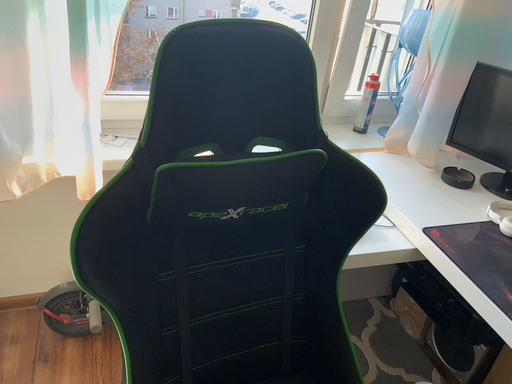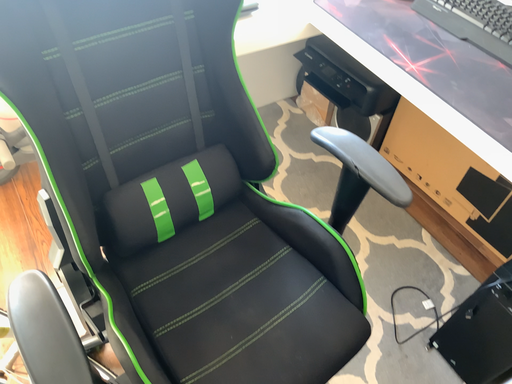
Question: How did the camera likely rotate when shooting the video?

Choices:
 (A) rotated downward
 (B) rotated upward

Answer: (A)